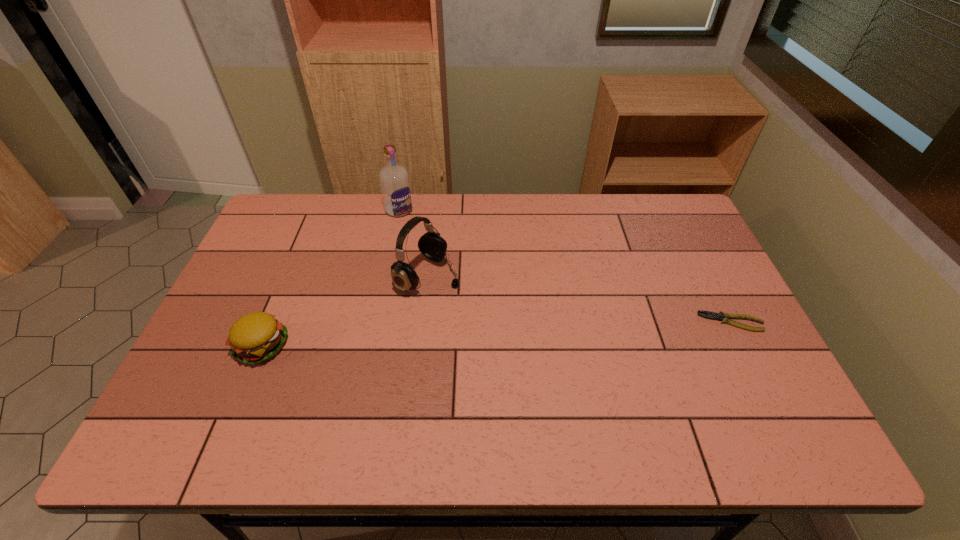
In the image, there is a desktop. Find the location of `vacant area at the left edge`. vacant area at the left edge is located at coordinates (275, 245).

What are the coordinates of `vacant space at the far right corner of the desktop` in the screenshot? It's located at (665, 225).

In the image, there is a desktop. Where is `vacant space at the near right corner`? The width and height of the screenshot is (960, 540). vacant space at the near right corner is located at coordinates (779, 386).

The width and height of the screenshot is (960, 540). I want to click on empty location between the third tallest object and the pliers, so click(497, 334).

I want to click on unoccupied position between the hamburger and the vodka, so click(331, 278).

Locate an element on the screen. vacant space that's between the second shortest object and the shortest object is located at coordinates (497, 334).

At what (x,y) coordinates should I click in order to perform the action: click on free point between the hamburger and the rightmost object. Please return your answer as a coordinate pair (x, y). The width and height of the screenshot is (960, 540). Looking at the image, I should click on (497, 334).

Image resolution: width=960 pixels, height=540 pixels. I want to click on free space between the hamburger and the farthest object, so click(331, 278).

The height and width of the screenshot is (540, 960). Find the location of `vacant space in between the pliers and the headset`. vacant space in between the pliers and the headset is located at coordinates coord(580,299).

Where is `free space between the farthest object and the third nearest object`? The height and width of the screenshot is (540, 960). free space between the farthest object and the third nearest object is located at coordinates (414, 243).